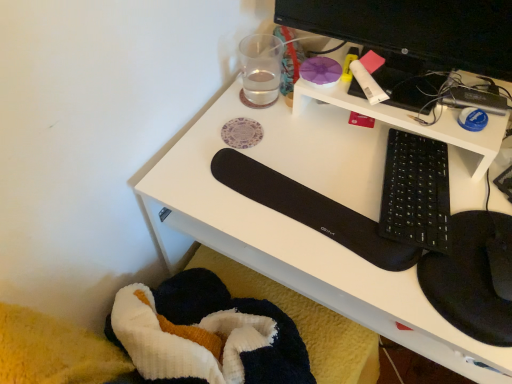
At what (x,y) coordinates should I click in order to perform the action: click on free space that is in between black matte keyboard at center-right and transparent glass at upper center, the 1th stationery from the back. Please return your answer as a coordinate pair (x, y). The height and width of the screenshot is (384, 512). Looking at the image, I should click on (317, 144).